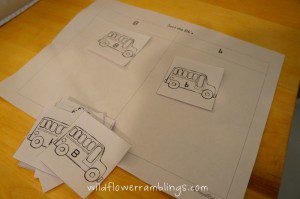
Where is `dark spot on table top to the right of the paper`? The width and height of the screenshot is (300, 199). dark spot on table top to the right of the paper is located at coordinates (261, 186).